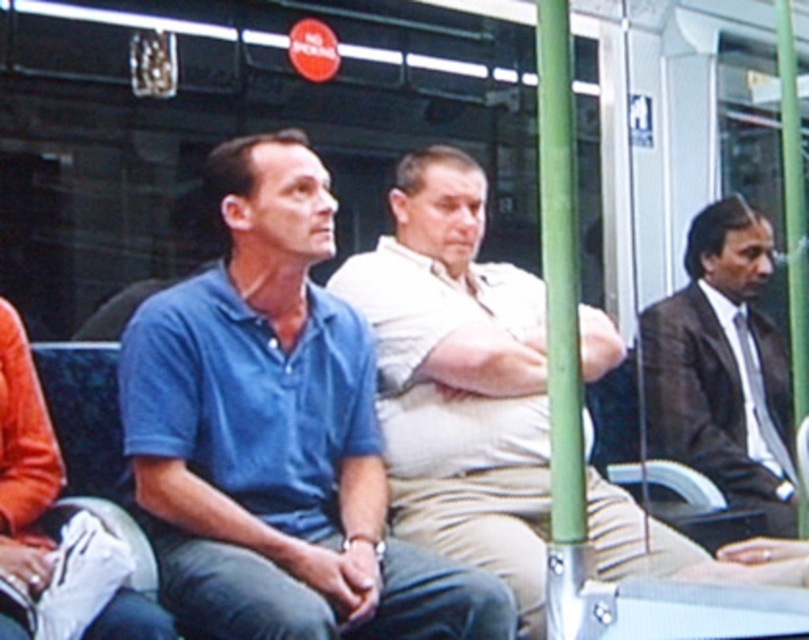
You are a passenger on a bus and need to store your backpack. You see a beige cotton shirt at center and a dark brown suit at right. Which clothing item takes up more space?

The beige cotton shirt at center is bigger than the dark brown suit at right, so it takes up more space.